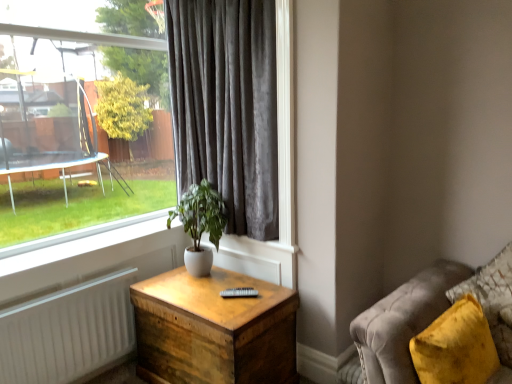
At what (x,y) coordinates should I click in order to perform the action: click on empty space that is ontop of wooden nightstand at center. Please return your answer as a coordinate pair (x, y). The width and height of the screenshot is (512, 384). Looking at the image, I should click on (219, 291).